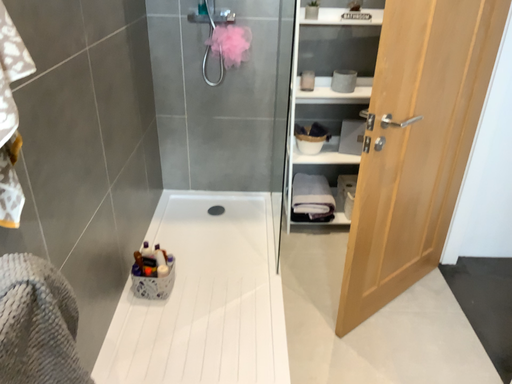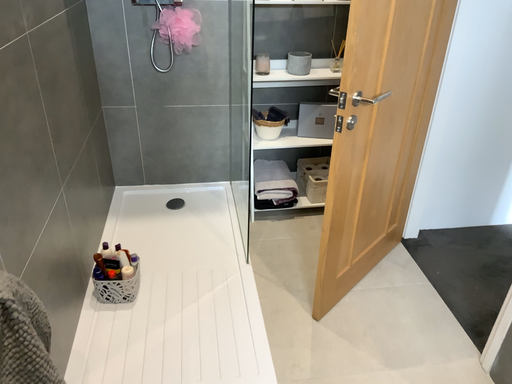
Question: Which way did the camera rotate in the video?

Choices:
 (A) rotated left
 (B) rotated right

Answer: (B)